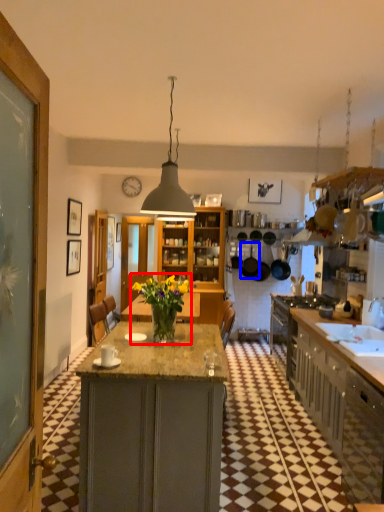
Question: Among these objects, which one is nearest to the camera, houseplant (highlighted by a red box) or kitchen appliance (highlighted by a blue box)?

Choices:
 (A) houseplant
 (B) kitchen appliance

Answer: (A)